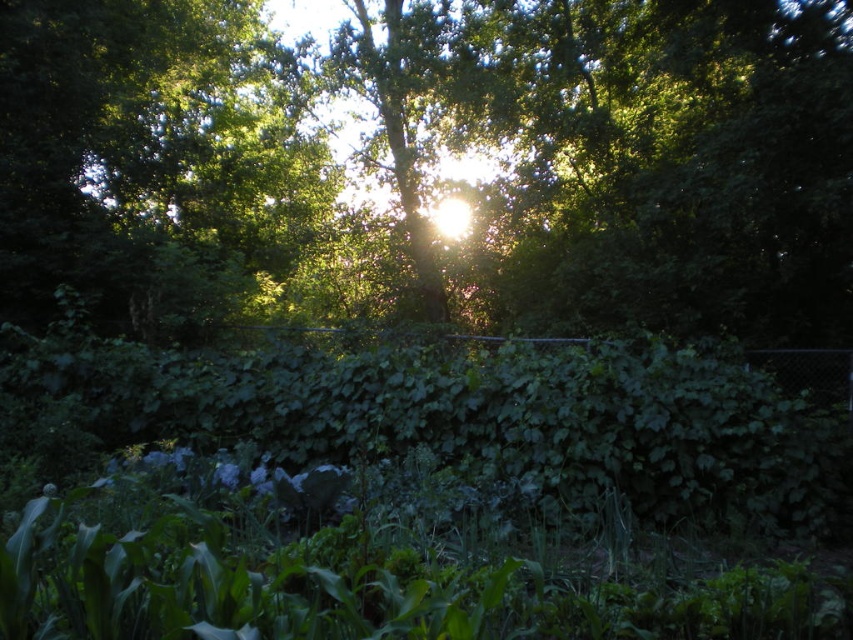
Question: In this image, where is green leafy tree at center located relative to green leafy hedge at center?

Choices:
 (A) right
 (B) left

Answer: (A)

Question: Which point is closer to the camera?

Choices:
 (A) green leafy hedge at center
 (B) green leafy tree at center

Answer: (A)

Question: Observing the image, what is the correct spatial positioning of green leafy tree at center in reference to green leafy hedge at center?

Choices:
 (A) below
 (B) above

Answer: (B)

Question: Which point is farther from the camera taking this photo?

Choices:
 (A) (273, 388)
 (B) (819, 292)

Answer: (B)

Question: Which point is closer to the camera taking this photo?

Choices:
 (A) (120, 154)
 (B) (709, 394)

Answer: (B)

Question: Does green leafy tree at center have a lesser width compared to green leafy hedge at center?

Choices:
 (A) no
 (B) yes

Answer: (A)